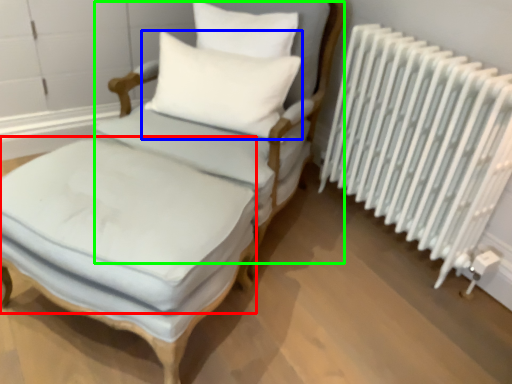
Question: Estimate the real-world distances between objects in this image. Which object is farther from mattress (highlighted by a red box), pillow (highlighted by a blue box) or armchair (highlighted by a green box)?

Choices:
 (A) pillow
 (B) armchair

Answer: (A)